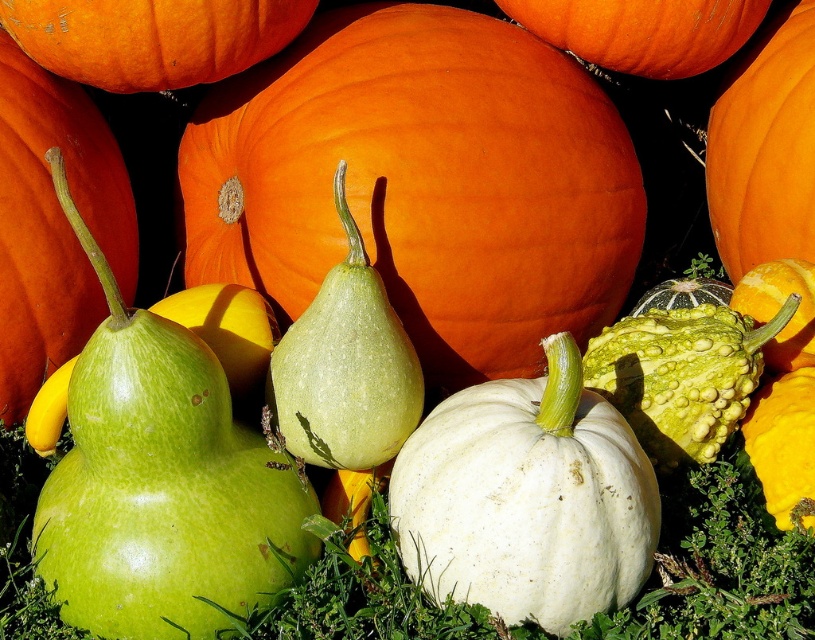
Question: Is orange matte pumpkin at center positioned in front of white matte pumpkin at center?

Choices:
 (A) yes
 (B) no

Answer: (B)

Question: Observing the image, what is the correct spatial positioning of orange matte pumpkin at center in reference to white matte pumpkin at center?

Choices:
 (A) right
 (B) left

Answer: (B)

Question: Among these points, which one is nearest to the camera?

Choices:
 (A) (576, 436)
 (B) (496, 237)

Answer: (A)

Question: Which object appears closest to the camera in this image?

Choices:
 (A) white matte pumpkin at center
 (B) orange matte pumpkin at center

Answer: (A)

Question: Is orange matte pumpkin at center further to camera compared to white matte pumpkin at center?

Choices:
 (A) no
 (B) yes

Answer: (B)